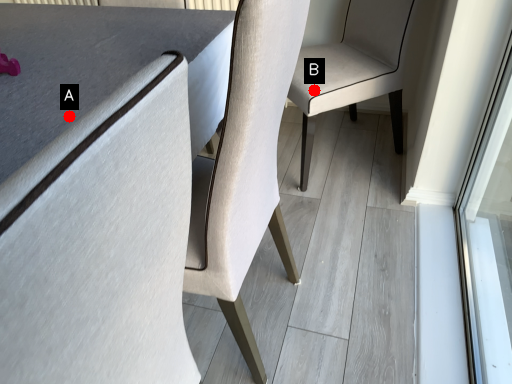
Question: Two points are circled on the image, labeled by A and B beside each circle. Which of the following is the farthest from the observer?

Choices:
 (A) A is further
 (B) B is further

Answer: (B)